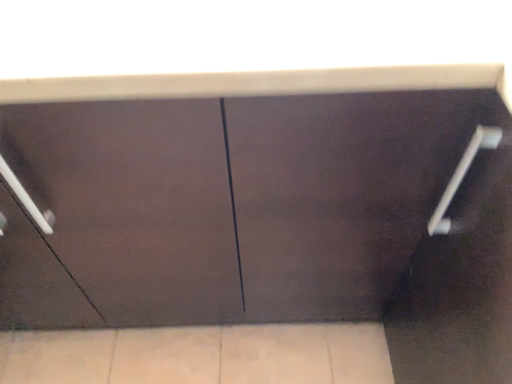
Find the location of a particular element. matte dark brown cabinet at center is located at coordinates (225, 204).

The image size is (512, 384). Describe the element at coordinates (225, 204) in the screenshot. I see `matte dark brown cabinet at center` at that location.

Find the location of a particular element. The height and width of the screenshot is (384, 512). matte dark brown cabinet at center is located at coordinates (225, 204).